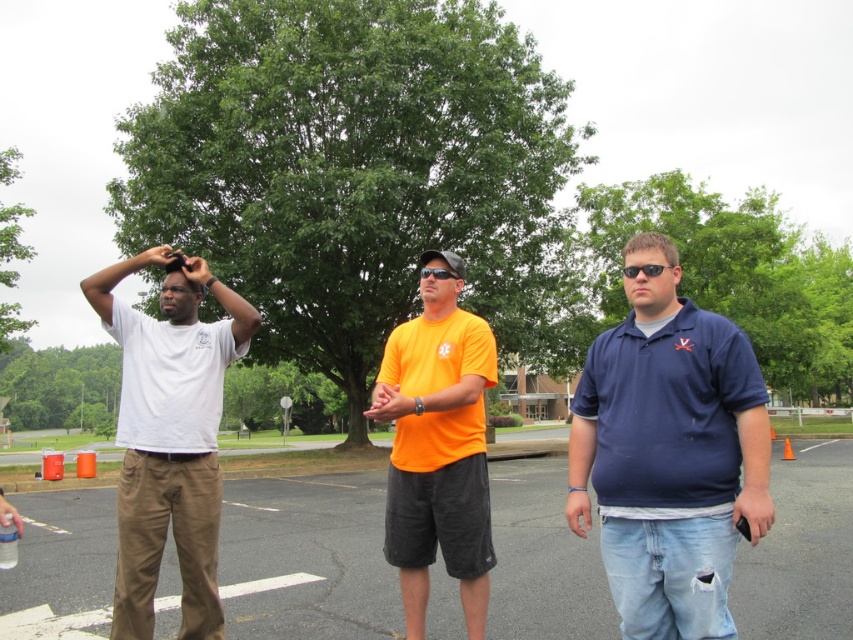
You are a photographer trying to capture the three men in the parking lot scene. You notice a specific point marked at coordinates (669, 454). Which man does this point correspond to?

The point at (669, 454) corresponds to the navy blue polo shirt at right.